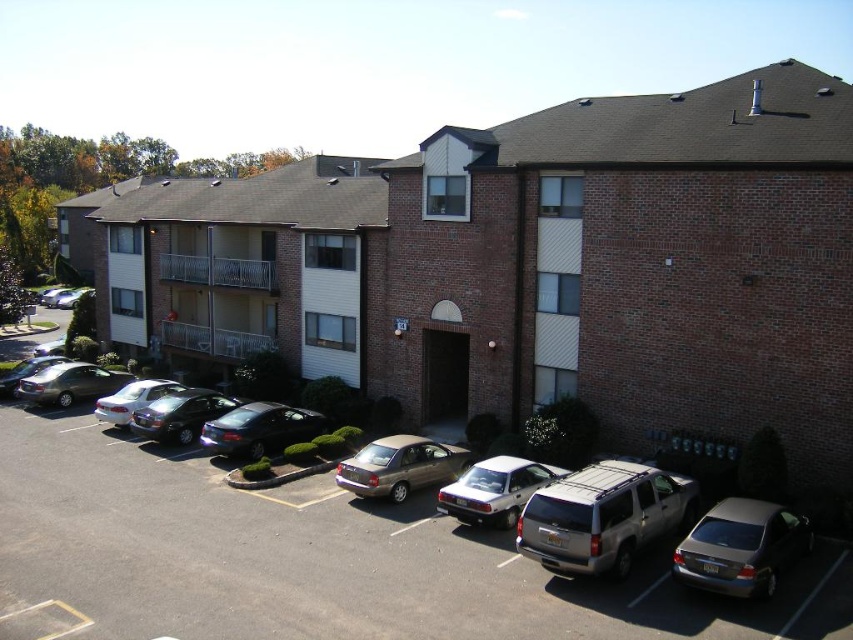
Between metallic silver sedan at lower right and shiny metallic sedan at center-left, which one is positioned lower?

metallic silver sedan at lower right is lower down.

Between metallic silver sedan at lower right and shiny metallic sedan at center-left, which one has more height?

Standing taller between the two is shiny metallic sedan at center-left.

This screenshot has width=853, height=640. What do you see at coordinates (740, 547) in the screenshot?
I see `metallic silver sedan at lower right` at bounding box center [740, 547].

In order to click on metallic silver sedan at lower right in this screenshot , I will do `click(740, 547)`.

Where is `metallic silver sedan at lower right`? The image size is (853, 640). metallic silver sedan at lower right is located at coordinates (740, 547).

Locate an element on the screen. metallic silver sedan at lower right is located at coordinates (740, 547).

Is satin black sedan at center to the left of shiny silver sedan at left from the viewer's perspective?

No, satin black sedan at center is not to the left of shiny silver sedan at left.

Is satin black sedan at center taller than shiny silver sedan at left?

Correct, satin black sedan at center is much taller as shiny silver sedan at left.

Between point (254, 448) and point (109, 385), which one is positioned in front?

Positioned in front is point (254, 448).

What are the coordinates of `satin black sedan at center` in the screenshot? It's located at (260, 429).